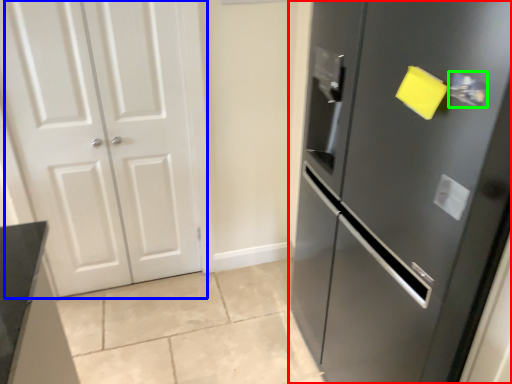
Question: Which object is positioned closest to door (highlighted by a red box)? Select from door (highlighted by a blue box) and door handle (highlighted by a green box).

Choices:
 (A) door
 (B) door handle

Answer: (B)